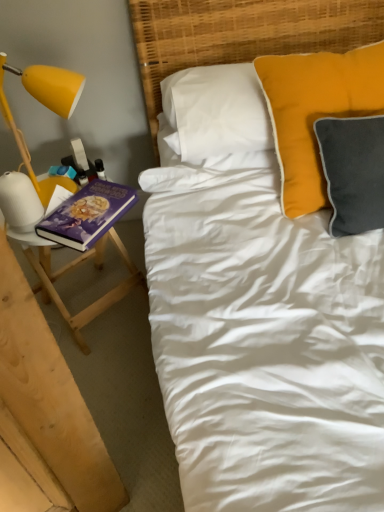
Question: Considering the relative positions of purple matte book at left and woven bamboo headboard at upper center in the image provided, is purple matte book at left behind woven bamboo headboard at upper center?

Choices:
 (A) no
 (B) yes

Answer: (B)

Question: Is woven bamboo headboard at upper center a part of purple matte book at left?

Choices:
 (A) yes
 (B) no

Answer: (B)

Question: Does purple matte book at left have a lesser height compared to woven bamboo headboard at upper center?

Choices:
 (A) yes
 (B) no

Answer: (A)

Question: Considering the relative sizes of purple matte book at left and woven bamboo headboard at upper center in the image provided, is purple matte book at left thinner than woven bamboo headboard at upper center?

Choices:
 (A) no
 (B) yes

Answer: (B)

Question: Is purple matte book at left bigger than woven bamboo headboard at upper center?

Choices:
 (A) no
 (B) yes

Answer: (A)

Question: From a real-world perspective, is woven bamboo headboard at upper center above or below purple matte book at left?

Choices:
 (A) below
 (B) above

Answer: (B)

Question: Considering their positions, is woven bamboo headboard at upper center located in front of or behind purple matte book at left?

Choices:
 (A) front
 (B) behind

Answer: (A)

Question: Looking at the image, does woven bamboo headboard at upper center seem bigger or smaller compared to purple matte book at left?

Choices:
 (A) big
 (B) small

Answer: (A)

Question: Considering the relative positions of woven bamboo headboard at upper center and purple matte book at left in the image provided, is woven bamboo headboard at upper center to the left or to the right of purple matte book at left?

Choices:
 (A) left
 (B) right

Answer: (B)

Question: From a real-world perspective, relative to woven bamboo headboard at upper center, is yellow matte lamp at left vertically above or below?

Choices:
 (A) below
 (B) above

Answer: (B)

Question: Is yellow matte lamp at left spatially inside woven bamboo headboard at upper center, or outside of it?

Choices:
 (A) outside
 (B) inside

Answer: (A)

Question: Is yellow matte lamp at left taller or shorter than woven bamboo headboard at upper center?

Choices:
 (A) short
 (B) tall

Answer: (A)

Question: Is yellow matte lamp at left wider or thinner than woven bamboo headboard at upper center?

Choices:
 (A) wide
 (B) thin

Answer: (B)

Question: Relative to yellow matte lamp at left, is woven bamboo headboard at upper center in front or behind?

Choices:
 (A) behind
 (B) front

Answer: (B)

Question: From a real-world perspective, is woven bamboo headboard at upper center positioned above or below yellow matte lamp at left?

Choices:
 (A) below
 (B) above

Answer: (A)